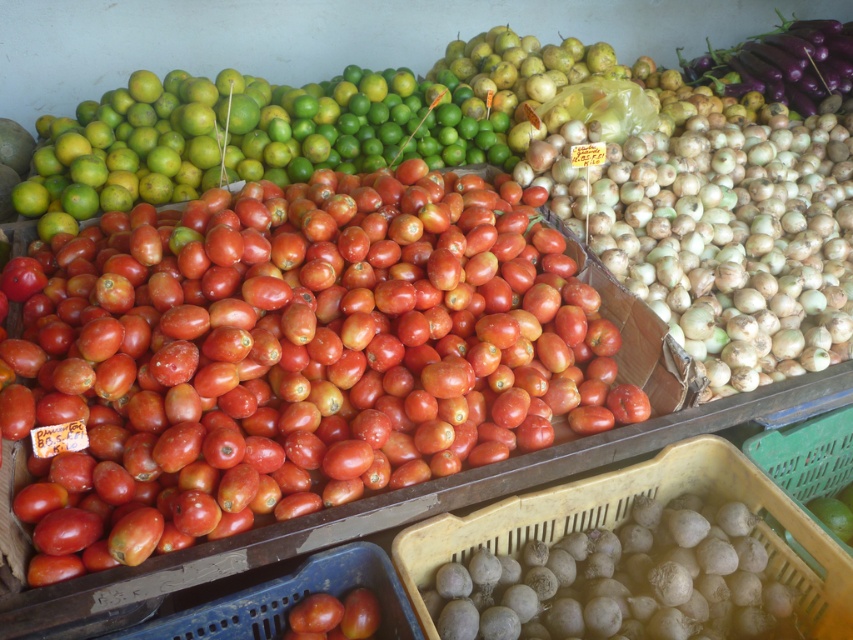
Question: Does shiny red tomato at center have a larger size compared to shiny red tomatoes at center?

Choices:
 (A) no
 (B) yes

Answer: (B)

Question: Which point is farther to the camera?

Choices:
 (A) shiny red tomato at center
 (B) shiny red tomatoes at center

Answer: (B)

Question: Does shiny red tomato at center appear on the right side of shiny red tomatoes at center?

Choices:
 (A) no
 (B) yes

Answer: (B)

Question: Is shiny red tomato at center bigger than shiny red tomatoes at center?

Choices:
 (A) no
 (B) yes

Answer: (B)